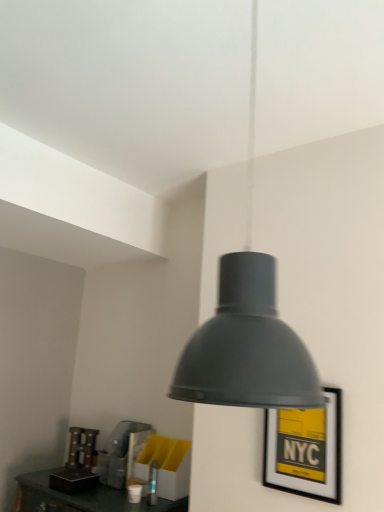
Measure the distance between yellow matte picture frame at center-right and camera.

yellow matte picture frame at center-right is 1.65 meters from camera.

This screenshot has width=384, height=512. What do you see at coordinates (305, 450) in the screenshot?
I see `yellow matte picture frame at center-right` at bounding box center [305, 450].

In order to face yellow matte picture frame at center-right, should I rotate leftwards or rightwards?

Turn right approximately 13.929 degrees to face it.

Where is `yellow matte picture frame at center-right`? The width and height of the screenshot is (384, 512). yellow matte picture frame at center-right is located at coordinates (305, 450).

The height and width of the screenshot is (512, 384). I want to click on matte black lampshade at center, so click(x=247, y=328).

In order to face matte black lampshade at center, should I rotate leftwards or rightwards?

Rotate your view right by about 8.505°.

Describe the element at coordinates (247, 328) in the screenshot. This screenshot has width=384, height=512. I see `matte black lampshade at center` at that location.

Find the location of a particular element. This screenshot has width=384, height=512. yellow matte picture frame at center-right is located at coordinates (305, 450).

Looking at this image, considering the positions of objects yellow matte picture frame at center-right and matte black lampshade at center in the image provided, who is more to the right, yellow matte picture frame at center-right or matte black lampshade at center?

→ Positioned to the right is yellow matte picture frame at center-right.

Which is behind, yellow matte picture frame at center-right or matte black lampshade at center?

yellow matte picture frame at center-right is further from the camera.

Is point (309, 490) positioned after point (194, 346)?

Yes, point (309, 490) is farther from viewer.

From the image's perspective, is yellow matte picture frame at center-right on matte black lampshade at center?

No.

From a real-world perspective, who is located lower, yellow matte picture frame at center-right or matte black lampshade at center?

In real-world perspective, yellow matte picture frame at center-right is lower.

Considering the sizes of objects yellow matte picture frame at center-right and matte black lampshade at center in the image provided, who is wider, yellow matte picture frame at center-right or matte black lampshade at center?

matte black lampshade at center.

Does yellow matte picture frame at center-right have a lesser height compared to matte black lampshade at center?

Yes, yellow matte picture frame at center-right is shorter than matte black lampshade at center.

Is yellow matte picture frame at center-right smaller than matte black lampshade at center?

Yes, yellow matte picture frame at center-right is smaller than matte black lampshade at center.

Do you think yellow matte picture frame at center-right is within matte black lampshade at center, or outside of it?

yellow matte picture frame at center-right is spatially situated outside matte black lampshade at center.

Looking at this image, is yellow matte picture frame at center-right positioned far away from matte black lampshade at center?

Yes, yellow matte picture frame at center-right and matte black lampshade at center are quite far apart.

Is yellow matte picture frame at center-right oriented away from matte black lampshade at center?

No, yellow matte picture frame at center-right is not facing the opposite direction of matte black lampshade at center.

Can you tell me how much yellow matte picture frame at center-right and matte black lampshade at center differ in facing direction?

yellow matte picture frame at center-right and matte black lampshade at center are facing 33.6 degrees away from each other.

Where is `picture frame on the right of matte black lampshade at center`? This screenshot has width=384, height=512. picture frame on the right of matte black lampshade at center is located at coordinates (305, 450).

In the image, is matte black lampshade at center on the left side or the right side of yellow matte picture frame at center-right?

Based on their positions, matte black lampshade at center is located to the left of yellow matte picture frame at center-right.

Who is more distant, matte black lampshade at center or yellow matte picture frame at center-right?

Positioned behind is yellow matte picture frame at center-right.

Consider the image. Which point is more distant from viewer, (211,402) or (301,481)?

The point (301,481) is more distant.

From the image's perspective, is matte black lampshade at center located above yellow matte picture frame at center-right?

Yes, from the image's perspective, matte black lampshade at center is over yellow matte picture frame at center-right.

From a real-world perspective, is matte black lampshade at center on top of yellow matte picture frame at center-right?

Yes, from a real-world perspective, matte black lampshade at center is above yellow matte picture frame at center-right.

Considering the relative sizes of matte black lampshade at center and yellow matte picture frame at center-right in the image provided, is matte black lampshade at center thinner than yellow matte picture frame at center-right?

No.

Considering the relative sizes of matte black lampshade at center and yellow matte picture frame at center-right in the image provided, is matte black lampshade at center taller than yellow matte picture frame at center-right?

Yes.

Between matte black lampshade at center and yellow matte picture frame at center-right, which one has smaller size?

yellow matte picture frame at center-right is smaller.

Does matte black lampshade at center contain yellow matte picture frame at center-right?

Actually, yellow matte picture frame at center-right is outside matte black lampshade at center.

Is matte black lampshade at center with yellow matte picture frame at center-right?

matte black lampshade at center and yellow matte picture frame at center-right are clearly separated.

Could you tell me if matte black lampshade at center is turned towards yellow matte picture frame at center-right?

No, matte black lampshade at center is not facing towards yellow matte picture frame at center-right.

Identify the location of lamp above the yellow matte picture frame at center-right (from a real-world perspective). (247, 328).

Locate an element on the screen. picture frame below the matte black lampshade at center (from a real-world perspective) is located at coordinates (305, 450).

What are the coordinates of `picture frame behind the matte black lampshade at center` in the screenshot? It's located at (305, 450).